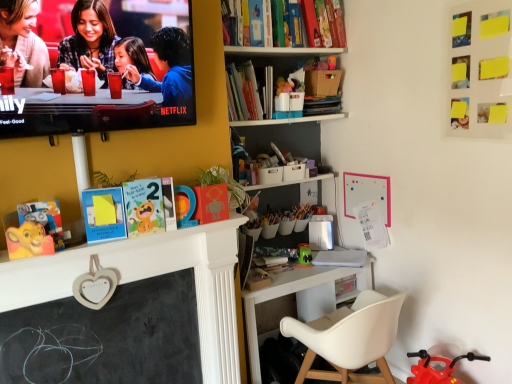
Image resolution: width=512 pixels, height=384 pixels. What do you see at coordinates (129, 41) in the screenshot?
I see `matte black laptop at upper left` at bounding box center [129, 41].

Describe the element at coordinates (309, 23) in the screenshot. I see `hardcover book at upper center, arranged as the third book when ordered from the bottom` at that location.

At what (x,y) coordinates should I click in order to perform the action: click on white plastic desk at center. Please return your answer as a coordinate pair (x, y). Looking at the image, I should click on (301, 298).

Can you confirm if hardcover book at upper center, which appears as the 2th book when ordered from the bottom, is smaller than green matte toy at center?

Incorrect, hardcover book at upper center, which appears as the 2th book when ordered from the bottom, is not smaller in size than green matte toy at center.

Is hardcover book at upper center, arranged as the second book when viewed from the top, far from green matte toy at center?

That's right, there is a large distance between hardcover book at upper center, arranged as the second book when viewed from the top, and green matte toy at center.

Which object is positioned more to the right, hardcover book at upper center, arranged as the second book when viewed from the top, or green matte toy at center?

green matte toy at center.

Which is in front, point (244, 117) or point (309, 256)?

The point (244, 117) is in front.

Looking at this image, between hardcover book at upper center, arranged as the third book when ordered from the bottom, and white paper at desk center, the 1th book when ordered from bottom to top, which one has smaller width?

hardcover book at upper center, arranged as the third book when ordered from the bottom, is thinner.

From a real-world perspective, is hardcover book at upper center, arranged as the third book when ordered from the bottom, under white paper at desk center, the 1th book when ordered from bottom to top?

No, from a real-world perspective, hardcover book at upper center, arranged as the third book when ordered from the bottom, is not below white paper at desk center, the 1th book when ordered from bottom to top.

Where is `book behind the hardcover book at upper center, which ranks as the 1th book in top-to-bottom order`? This screenshot has width=512, height=384. book behind the hardcover book at upper center, which ranks as the 1th book in top-to-bottom order is located at coordinates (341, 258).

Is hardcover book at upper center, which ranks as the 1th book in top-to-bottom order, turned away from white paper at desk center, the 3th book from the top?

No, hardcover book at upper center, which ranks as the 1th book in top-to-bottom order, is not facing the opposite direction of white paper at desk center, the 3th book from the top.

Considering the sizes of objects white paper at desk center, the 3th book from the top, and matte black laptop at upper left in the image provided, who is thinner, white paper at desk center, the 3th book from the top, or matte black laptop at upper left?

matte black laptop at upper left.

Would you say white paper at desk center, the 3th book from the top, is outside matte black laptop at upper left?

Yes, white paper at desk center, the 3th book from the top, is not within matte black laptop at upper left.

Which is more to the left, white paper at desk center, the 3th book from the top, or matte black laptop at upper left?

matte black laptop at upper left.

From the image's perspective, does white paper at desk center, the 1th book when ordered from bottom to top, appear higher than matte black laptop at upper left?

No.

Between white paper at desk center, the 3th book from the top, and green matte toy at center, which one has less height?

white paper at desk center, the 3th book from the top, is shorter.

Is point (336, 260) closer to camera compared to point (305, 250)?

Yes, point (336, 260) is closer to viewer.

Looking at this image, is white paper at desk center, the 1th book when ordered from bottom to top, at the left side of green matte toy at center?

No, white paper at desk center, the 1th book when ordered from bottom to top, is not to the left of green matte toy at center.

Is white paper at desk center, the 1th book when ordered from bottom to top, further to camera compared to green matte toy at center?

No, white paper at desk center, the 1th book when ordered from bottom to top, is in front of green matte toy at center.

This screenshot has height=384, width=512. I want to click on the 3rd book to the right of the black chalkboard at center-left, starting your count from the anchor, so click(341, 258).

From a real-world perspective, is white paper at desk center, the 1th book when ordered from bottom to top, beneath black chalkboard at center-left?

No, from a real-world perspective, white paper at desk center, the 1th book when ordered from bottom to top, is not under black chalkboard at center-left.

Between white paper at desk center, the 3th book from the top, and black chalkboard at center-left, which one has more height?

With more height is black chalkboard at center-left.

Is white paper at desk center, the 1th book when ordered from bottom to top, situated inside black chalkboard at center-left or outside?

The correct answer is: outside.

Who is smaller, white plastic desk at center or white paper at desk center, the 1th book when ordered from bottom to top?

With smaller size is white paper at desk center, the 1th book when ordered from bottom to top.

You are a GUI agent. You are given a task and a screenshot of the screen. Output one action in this format:
    pyautogui.click(x=<x>, y=<y>)
    Task: Click on the 3rd book behind when counting from the white plastic desk at center
    
    Given the screenshot: What is the action you would take?
    pyautogui.click(x=341, y=258)

Is point (323, 283) in front of point (357, 265)?

That is True.

From the image's perspective, is matte black laptop at upper left below green matte toy at center?

Actually, matte black laptop at upper left appears above green matte toy at center in the image.

The image size is (512, 384). What are the coordinates of `toy located behind the matte black laptop at upper left` in the screenshot? It's located at (304, 254).

Which point is more distant from viewer, (21, 19) or (300, 246)?

Point (300, 246)

Considering the positions of objects matte black laptop at upper left and green matte toy at center in the image provided, who is more to the left, matte black laptop at upper left or green matte toy at center?

matte black laptop at upper left.

Locate an element on the screen. This screenshot has height=384, width=512. toy directly beneath the hardcover book at upper center, which appears as the 2th book when ordered from the bottom (from a real-world perspective) is located at coordinates (304, 254).

Image resolution: width=512 pixels, height=384 pixels. Find the location of `book to the right of hardcover book at upper center, arranged as the third book when ordered from the bottom`. book to the right of hardcover book at upper center, arranged as the third book when ordered from the bottom is located at coordinates (341, 258).

Which object lies nearer to the anchor point black chalkboard at center-left, white plastic desk at center or green matte toy at center?

white plastic desk at center is closer to black chalkboard at center-left.

From the image, which object appears to be nearer to hardcover book at upper center, which appears as the 2th book when ordered from the bottom, green matte toy at center or white paper at desk center, the 1th book when ordered from bottom to top?

Among the two, green matte toy at center is located nearer to hardcover book at upper center, which appears as the 2th book when ordered from the bottom.

Consider the image. Looking at the image, which one is located closer to hardcover book at upper center, arranged as the third book when ordered from the bottom, white plastic chair at lower right or white paper at desk center, the 1th book when ordered from bottom to top?

Among the two, white paper at desk center, the 1th book when ordered from bottom to top, is located nearer to hardcover book at upper center, arranged as the third book when ordered from the bottom.

When comparing their distances from white plastic chair at lower right, does hardcover book at upper center, arranged as the third book when ordered from the bottom, or white plastic desk at center seem closer?

white plastic desk at center is positioned closer to the anchor white plastic chair at lower right.

Based on the photo, considering their positions, is black chalkboard at center-left positioned closer to white paper at desk center, the 1th book when ordered from bottom to top, than hardcover book at upper center, which appears as the 2th book when ordered from the bottom?

black chalkboard at center-left is closer to white paper at desk center, the 1th book when ordered from bottom to top.

Based on their spatial positions, is hardcover book at upper center, which ranks as the 1th book in top-to-bottom order, or white paper at desk center, the 1th book when ordered from bottom to top, further from white plastic chair at lower right?

hardcover book at upper center, which ranks as the 1th book in top-to-bottom order, is positioned further to the anchor white plastic chair at lower right.

Considering their positions, is black chalkboard at center-left positioned further to white plastic desk at center than white paper at desk center, the 1th book when ordered from bottom to top?

black chalkboard at center-left lies further to white plastic desk at center than the other object.

Which object lies nearer to the anchor point white plastic desk at center, white paper at desk center, the 3th book from the top, or hardcover book at upper center, which ranks as the 1th book in top-to-bottom order?

Based on the image, white paper at desk center, the 3th book from the top, appears to be nearer to white plastic desk at center.

This screenshot has width=512, height=384. I want to click on table that lies between hardcover book at upper center, which appears as the 2th book when ordered from the bottom, and white plastic chair at lower right from top to bottom, so click(x=301, y=298).

Where is `book positioned between matte black laptop at upper left and hardcover book at upper center, which ranks as the 1th book in top-to-bottom order, from near to far`? The height and width of the screenshot is (384, 512). book positioned between matte black laptop at upper left and hardcover book at upper center, which ranks as the 1th book in top-to-bottom order, from near to far is located at coordinates (243, 93).

Find the location of a particular element. This screenshot has height=384, width=512. toy between hardcover book at upper center, arranged as the third book when ordered from the bottom, and white paper at desk center, the 1th book when ordered from bottom to top, in the vertical direction is located at coordinates (304, 254).

At what (x,y) coordinates should I click in order to perform the action: click on toy between hardcover book at upper center, which ranks as the 1th book in top-to-bottom order, and white plastic desk at center in the up-down direction. Please return your answer as a coordinate pair (x, y). Image resolution: width=512 pixels, height=384 pixels. Looking at the image, I should click on (304, 254).